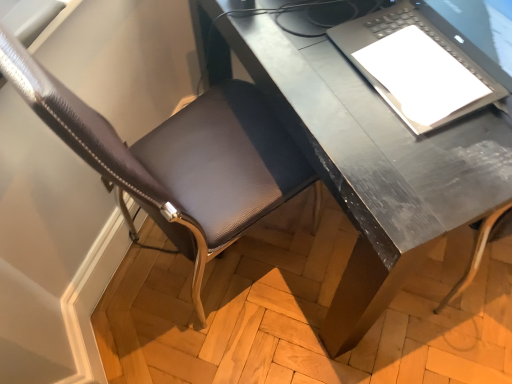
Question: Considering the positions of leather-like brown chair at lower left and matte black laptop at upper right in the image, is leather-like brown chair at lower left bigger or smaller than matte black laptop at upper right?

Choices:
 (A) small
 (B) big

Answer: (B)

Question: From the image's perspective, is leather-like brown chair at lower left above or below matte black laptop at upper right?

Choices:
 (A) below
 (B) above

Answer: (A)

Question: Based on their relative distances, which object is nearer to the leather-like brown chair at lower left?

Choices:
 (A) matte black laptop at upper right
 (B) metallic gray desk at center

Answer: (B)

Question: Considering the real-world distances, which object is closest to the leather-like brown chair at lower left?

Choices:
 (A) metallic gray desk at center
 (B) matte black laptop at upper right

Answer: (A)